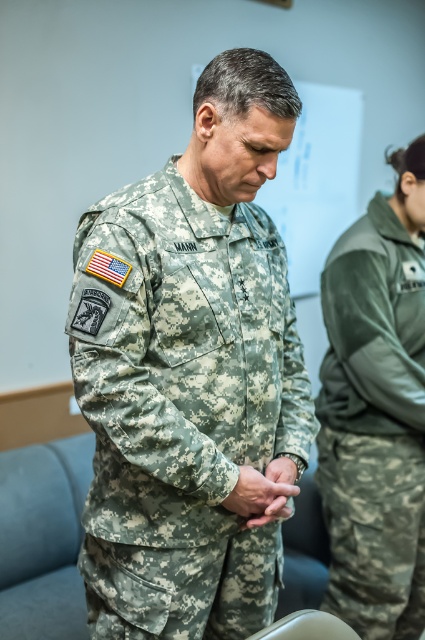
Question: Which point is closer to the camera taking this photo?

Choices:
 (A) (153, 227)
 (B) (274, 468)
 (C) (391, 234)

Answer: (A)

Question: Does camouflage fabric uniform at center lie behind camouflage fabric hand at center?

Choices:
 (A) yes
 (B) no

Answer: (B)

Question: Which point is farther to the camera?

Choices:
 (A) [x=232, y=317]
 (B) [x=272, y=460]
 (C) [x=414, y=582]

Answer: (C)

Question: Is camouflage fabric uniform at center in front of camouflage fabric hand at center?

Choices:
 (A) no
 (B) yes

Answer: (B)

Question: Which point appears farthest from the camera in this image?

Choices:
 (A) (404, 376)
 (B) (186, 467)

Answer: (A)

Question: Does camouflage fabric uniform at center appear on the right side of camouflage fabric hand at center?

Choices:
 (A) no
 (B) yes

Answer: (A)